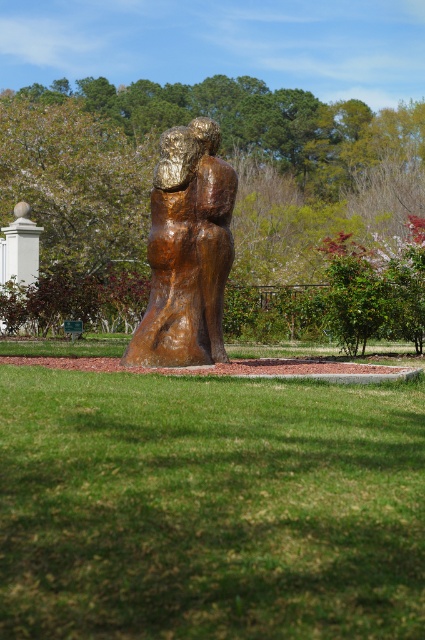
Which is in front, point (363, 502) or point (31, 198)?

Point (363, 502) is more forward.

Between point (158, 476) and point (393, 131), which one is positioned behind?

Point (393, 131)

Does point (297, 504) come behind point (421, 294)?

No, (297, 504) is in front of (421, 294).

Image resolution: width=425 pixels, height=640 pixels. In order to click on green grass at center in this screenshot , I will do `click(209, 508)`.

Who is positioned more to the right, green grass at center or bronze/smoothsculpture at center?

green grass at center

Which is behind, point (320, 625) or point (178, 164)?

The point (178, 164) is more distant.

Image resolution: width=425 pixels, height=640 pixels. I want to click on green grass at center, so click(x=209, y=508).

Who is more forward, (149, 81) or (218, 241)?

Point (218, 241)

Does green leafy tree at center have a larger size compared to bronze/smoothsculpture at center?

Yes, green leafy tree at center is bigger than bronze/smoothsculpture at center.

Where is `green leafy tree at center`? green leafy tree at center is located at coordinates (235, 200).